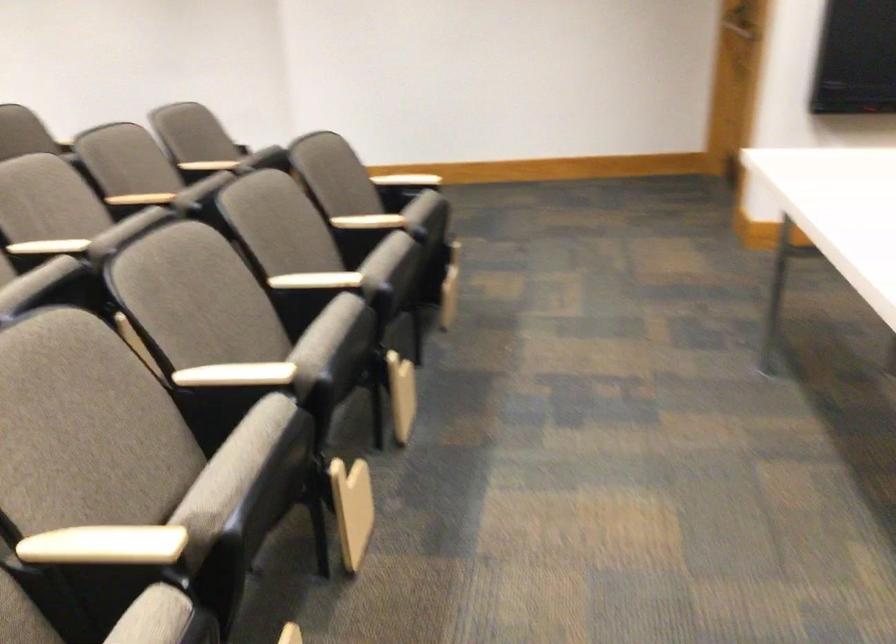
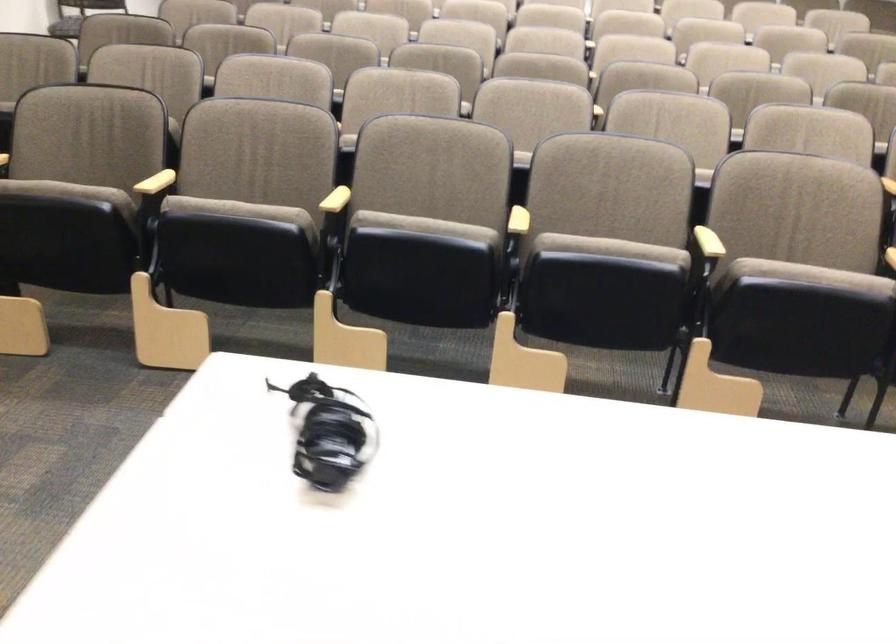
Where in the second image is the point corresponding to the point at 243,371 from the first image?

(518, 221)